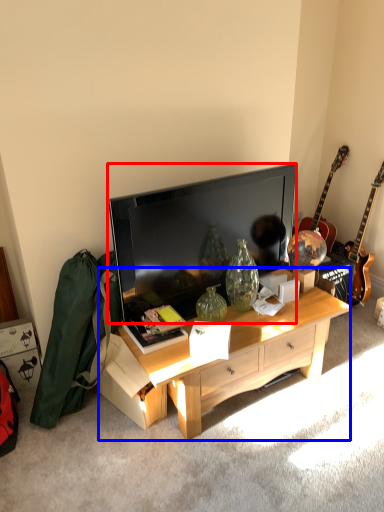
Question: Among these objects, which one is farthest to the camera, television (highlighted by a red box) or desk (highlighted by a blue box)?

Choices:
 (A) television
 (B) desk

Answer: (A)